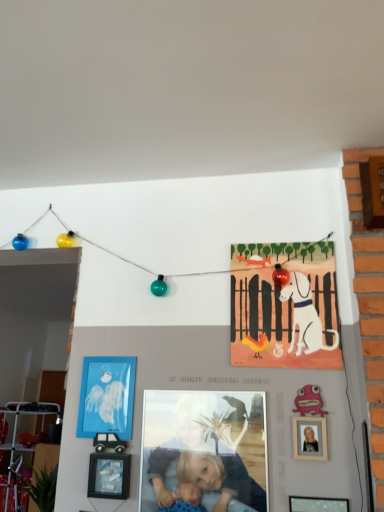
Question: Can you confirm if smooth skin child at center is positioned to the left of wooden picture frame at lower center, which appears as the second picture frame when viewed from the front?

Choices:
 (A) yes
 (B) no

Answer: (B)

Question: Is smooth skin child at center placed right next to wooden picture frame at lower center, which ranks as the 2th picture frame in back-to-front order?

Choices:
 (A) yes
 (B) no

Answer: (B)

Question: Does smooth skin child at center appear on the right side of wooden picture frame at lower center, marked as the 2th picture frame in a left-to-right arrangement?

Choices:
 (A) yes
 (B) no

Answer: (A)

Question: From the image's perspective, does smooth skin child at center appear lower than wooden picture frame at lower center, which ranks as the 2th picture frame in back-to-front order?

Choices:
 (A) no
 (B) yes

Answer: (A)

Question: From a real-world perspective, is smooth skin child at center under wooden picture frame at lower center, which ranks as the 2th picture frame in back-to-front order?

Choices:
 (A) no
 (B) yes

Answer: (A)

Question: Is blue paper picture frame at lower left, arranged as the first picture frame when viewed from the back, wider or thinner than matte paper poster at upper center?

Choices:
 (A) thin
 (B) wide

Answer: (A)

Question: From a real-world perspective, is blue paper picture frame at lower left, which is the third picture frame in bottom-to-top order, above or below matte paper poster at upper center?

Choices:
 (A) above
 (B) below

Answer: (B)

Question: Is blue paper picture frame at lower left, which is the 1th picture frame from top to bottom, to the left or to the right of matte paper poster at upper center in the image?

Choices:
 (A) right
 (B) left

Answer: (B)

Question: Considering the positions of blue paper picture frame at lower left, arranged as the first picture frame when viewed from the back, and matte paper poster at upper center in the image, is blue paper picture frame at lower left, arranged as the first picture frame when viewed from the back, taller or shorter than matte paper poster at upper center?

Choices:
 (A) short
 (B) tall

Answer: (A)

Question: From the image's perspective, is matte black picture frame at lower right, which ranks as the 3th picture frame in left-to-right order, above or below matte paper poster at upper center?

Choices:
 (A) below
 (B) above

Answer: (A)

Question: Looking at the image, does matte black picture frame at lower right, which ranks as the 3th picture frame in top-to-bottom order, seem bigger or smaller compared to matte paper poster at upper center?

Choices:
 (A) small
 (B) big

Answer: (A)

Question: Considering the positions of matte black picture frame at lower right, acting as the 1th picture frame starting from the bottom, and matte paper poster at upper center in the image, is matte black picture frame at lower right, acting as the 1th picture frame starting from the bottom, wider or thinner than matte paper poster at upper center?

Choices:
 (A) thin
 (B) wide

Answer: (B)

Question: Is matte black picture frame at lower right, which is counted as the 1th picture frame, starting from the right, spatially inside matte paper poster at upper center, or outside of it?

Choices:
 (A) outside
 (B) inside

Answer: (A)

Question: Is smooth skin child at center bigger or smaller than wooden picture frame at lower center, the second picture frame in the bottom-to-top sequence?

Choices:
 (A) small
 (B) big

Answer: (B)

Question: Is point (240, 430) closer or farther from the camera than point (119, 493)?

Choices:
 (A) closer
 (B) farther

Answer: (A)